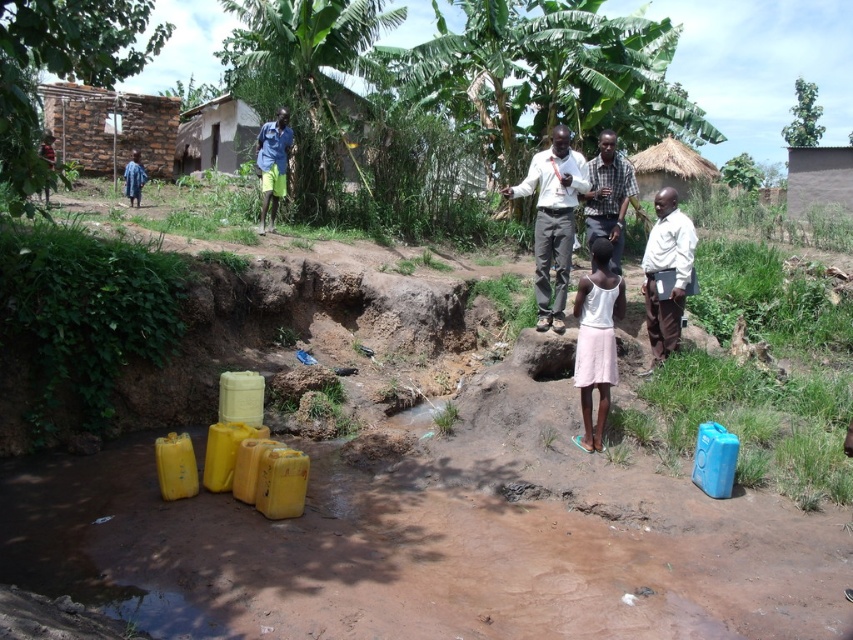
Does white matte shirt at center right appear over checkered fabric shirt at center?

Actually, white matte shirt at center right is below checkered fabric shirt at center.

Who is positioned more to the left, white matte shirt at center right or checkered fabric shirt at center?

checkered fabric shirt at center is more to the left.

Where is `white matte shirt at center right`? The width and height of the screenshot is (853, 640). white matte shirt at center right is located at coordinates (666, 269).

Who is higher up, white shirt at center or pink fabric skirt at center?

white shirt at center is above.

Is white shirt at center further to the viewer compared to pink fabric skirt at center?

Yes, white shirt at center is further from the viewer.

Is point (554, 240) closer to viewer compared to point (599, 305)?

No, (554, 240) is behind (599, 305).

Where is `white shirt at center`? white shirt at center is located at coordinates (552, 220).

Does pink fabric skirt at center appear on the left side of white matte shirt at center right?

Correct, you'll find pink fabric skirt at center to the left of white matte shirt at center right.

Can you confirm if pink fabric skirt at center is positioned above white matte shirt at center right?

No, pink fabric skirt at center is not above white matte shirt at center right.

Is point (575, 310) closer to camera compared to point (662, 209)?

Yes, point (575, 310) is in front of point (662, 209).

Identify the location of pink fabric skirt at center. The height and width of the screenshot is (640, 853). [596, 339].